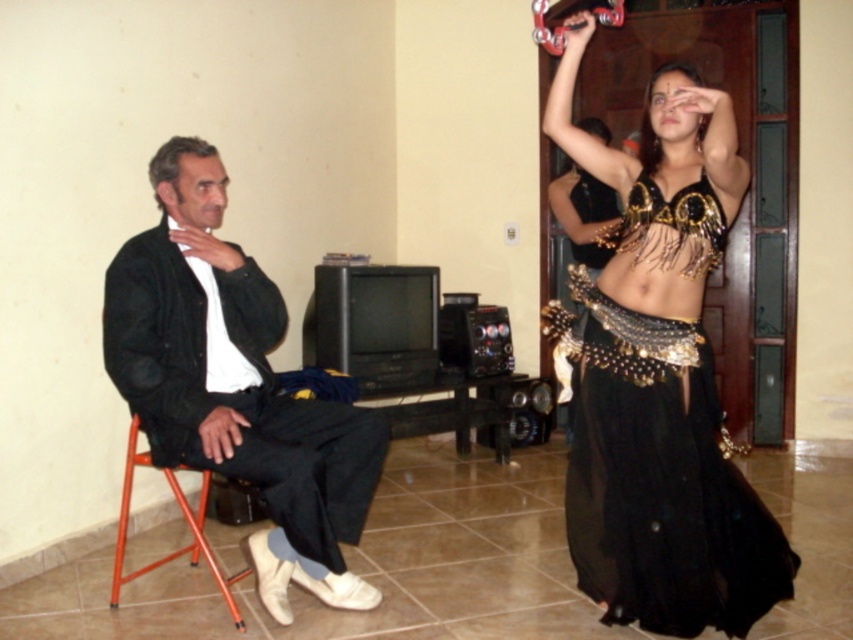
Question: Which object appears farthest from the camera in this image?

Choices:
 (A) black fabric jacket at left
 (B) shiny gold sequins at upper right
 (C) orange metal chair at left
 (D) black satin belly dancer at upper right

Answer: (B)

Question: Is black satin belly dancer at upper right closer to camera compared to black fabric jacket at left?

Choices:
 (A) no
 (B) yes

Answer: (B)

Question: Does black fabric jacket at left appear under shiny gold sequins at upper right?

Choices:
 (A) yes
 (B) no

Answer: (A)

Question: Considering the relative positions of black fabric jacket at left and shiny gold sequins at upper right in the image provided, where is black fabric jacket at left located with respect to shiny gold sequins at upper right?

Choices:
 (A) right
 (B) left

Answer: (B)

Question: Considering the real-world distances, which object is farthest from the black satin belly dancer at upper right?

Choices:
 (A) black fabric jacket at left
 (B) orange metal chair at left
 (C) shiny gold sequins at upper right

Answer: (B)

Question: Which point appears closest to the camera in this image?

Choices:
 (A) (132, 417)
 (B) (614, 368)

Answer: (B)